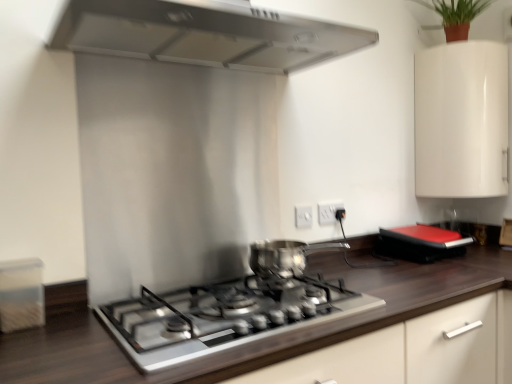
The height and width of the screenshot is (384, 512). Describe the element at coordinates (260, 340) in the screenshot. I see `dark wood countertop at center` at that location.

What do you see at coordinates (328, 212) in the screenshot?
I see `white plastic electric outlet at center, placed as the first electric outlet when sorted from back to front` at bounding box center [328, 212].

Describe the element at coordinates (204, 34) in the screenshot. The width and height of the screenshot is (512, 384). I see `stainless steel range hood at upper center` at that location.

In order to face satin silver gas stove at center, should I rotate leftwards or rightwards?

Rotate left and turn 2.851 degrees.

Where is `satin silver gas stove at center`? The width and height of the screenshot is (512, 384). satin silver gas stove at center is located at coordinates (224, 316).

Image resolution: width=512 pixels, height=384 pixels. What are the coordinates of `white plastic electric outlet at center, the 2th electric outlet viewed from the back` in the screenshot? It's located at (303, 216).

Does white glossy cabinet at upper right have a greater width compared to white plastic electric outlet at center, which ranks as the 1th electric outlet in front-to-back order?

Yes, white glossy cabinet at upper right is wider than white plastic electric outlet at center, which ranks as the 1th electric outlet in front-to-back order.

Is white glossy cabinet at upper right taller or shorter than white plastic electric outlet at center, the 2th electric outlet viewed from the back?

Considering their sizes, white glossy cabinet at upper right has more height than white plastic electric outlet at center, the 2th electric outlet viewed from the back.

Would you consider white glossy cabinet at upper right to be distant from white plastic electric outlet at center, the 1th electric outlet positioned from the left?

No, white glossy cabinet at upper right is not far away from white plastic electric outlet at center, the 1th electric outlet positioned from the left.

From the image's perspective, which electric outlet is the 2nd one below the white glossy cabinet at upper right? Please provide its 2D coordinates.

[(303, 216)]

In the scene shown: Which of these two, satin silver gas stove at center or white plastic electric outlet at center, the 1th electric outlet positioned from the left, is smaller?

white plastic electric outlet at center, the 1th electric outlet positioned from the left, is smaller.

From the image's perspective, is satin silver gas stove at center located above white plastic electric outlet at center, which ranks as the 1th electric outlet in front-to-back order?

Actually, satin silver gas stove at center appears below white plastic electric outlet at center, which ranks as the 1th electric outlet in front-to-back order, in the image.

Can white plastic electric outlet at center, marked as the 2th electric outlet in a right-to-left arrangement, be found inside satin silver gas stove at center?

No, white plastic electric outlet at center, marked as the 2th electric outlet in a right-to-left arrangement, is not a part of satin silver gas stove at center.

Which object is wider, white plastic electric outlet at center, acting as the 1th electric outlet starting from the right, or dark wood countertop at center?

Wider between the two is dark wood countertop at center.

Is white plastic electric outlet at center, acting as the 1th electric outlet starting from the right, in front of or behind dark wood countertop at center in the image?

white plastic electric outlet at center, acting as the 1th electric outlet starting from the right, is behind dark wood countertop at center.

Is white plastic electric outlet at center, acting as the 1th electric outlet starting from the right, with dark wood countertop at center?

white plastic electric outlet at center, acting as the 1th electric outlet starting from the right, and dark wood countertop at center are not in contact.

Image resolution: width=512 pixels, height=384 pixels. What are the coordinates of `the 2nd electric outlet above the dark wood countertop at center (from the image's perspective)` in the screenshot? It's located at (328, 212).

From a real-world perspective, is satin silver gas stove at center positioned over white glossy cabinet at upper right based on gravity?

Incorrect, from a real-world perspective, satin silver gas stove at center is lower than white glossy cabinet at upper right.

Which is in front, point (163, 365) or point (495, 158)?

The point (163, 365) is more forward.

Is satin silver gas stove at center shorter than white glossy cabinet at upper right?

Indeed, satin silver gas stove at center has a lesser height compared to white glossy cabinet at upper right.

In the image, is satin silver gas stove at center on the left side or the right side of white glossy cabinet at upper right?

satin silver gas stove at center is positioned on white glossy cabinet at upper right's left side.

Considering the positions of objects stainless steel range hood at upper center and green matte plant at upper right in the image provided, who is in front, stainless steel range hood at upper center or green matte plant at upper right?

stainless steel range hood at upper center is in front.

Which object is thinner, stainless steel range hood at upper center or green matte plant at upper right?

green matte plant at upper right is thinner.

The image size is (512, 384). What are the coordinates of `home appliance that is below the green matte plant at upper right (from the image's perspective)` in the screenshot? It's located at (204, 34).

Who is bigger, stainless steel range hood at upper center or green matte plant at upper right?

With larger size is stainless steel range hood at upper center.

Between shiny metallic pot at center and white plastic electric outlet at center, arranged as the second electric outlet when viewed from the front, which one has larger width?

Wider between the two is shiny metallic pot at center.

I want to click on the 2nd electric outlet behind when counting from the shiny metallic pot at center, so click(x=328, y=212).

Are shiny metallic pot at center and white plastic electric outlet at center, arranged as the second electric outlet when viewed from the front, far apart?

No.

Consider the image. Based on their sizes in the image, would you say shiny metallic pot at center is bigger or smaller than green matte plant at upper right?

shiny metallic pot at center is smaller than green matte plant at upper right.

Is shiny metallic pot at center aimed at green matte plant at upper right?

No, shiny metallic pot at center is not oriented towards green matte plant at upper right.

Who is taller, shiny metallic pot at center or green matte plant at upper right?

Standing taller between the two is green matte plant at upper right.

This screenshot has height=384, width=512. I want to click on plant above the shiny metallic pot at center (from a real-world perspective), so pos(455,11).

Where is `the 2nd electric outlet positioned below the white glossy cabinet at upper right (from the image's perspective)`? The height and width of the screenshot is (384, 512). the 2nd electric outlet positioned below the white glossy cabinet at upper right (from the image's perspective) is located at coordinates (303, 216).

Where is `gas stove that appears below the white plastic electric outlet at center, the 2th electric outlet viewed from the back (from a real-world perspective)`? This screenshot has height=384, width=512. gas stove that appears below the white plastic electric outlet at center, the 2th electric outlet viewed from the back (from a real-world perspective) is located at coordinates (224, 316).

Considering their positions, is stainless steel range hood at upper center positioned further to satin silver gas stove at center than white plastic electric outlet at center, placed as the first electric outlet when sorted from back to front?

stainless steel range hood at upper center is further to satin silver gas stove at center.

Based on their spatial positions, is satin silver gas stove at center or white plastic electric outlet at center, which ranks as the 1th electric outlet in front-to-back order, further from shiny metallic pot at center?

Based on the image, white plastic electric outlet at center, which ranks as the 1th electric outlet in front-to-back order, appears to be further to shiny metallic pot at center.

Based on their spatial positions, is white glossy cabinet at upper right or shiny metallic pot at center closer to green matte plant at upper right?

Based on the image, white glossy cabinet at upper right appears to be nearer to green matte plant at upper right.

Estimate the real-world distances between objects in this image. Which object is closer to white plastic electric outlet at center, which ranks as the 1th electric outlet in front-to-back order, stainless steel range hood at upper center or shiny metallic pot at center?

Based on the image, shiny metallic pot at center appears to be nearer to white plastic electric outlet at center, which ranks as the 1th electric outlet in front-to-back order.

Looking at the image, which one is located closer to stainless steel range hood at upper center, green matte plant at upper right or white glossy cabinet at upper right?

Among the two, white glossy cabinet at upper right is located nearer to stainless steel range hood at upper center.

From the image, which object appears to be nearer to white plastic electric outlet at center, which is counted as the 2th electric outlet, starting from the left, stainless steel range hood at upper center or green matte plant at upper right?

Based on the image, stainless steel range hood at upper center appears to be nearer to white plastic electric outlet at center, which is counted as the 2th electric outlet, starting from the left.

Consider the image. Estimate the real-world distances between objects in this image. Which object is closer to green matte plant at upper right, stainless steel range hood at upper center or dark wood countertop at center?

Based on the image, stainless steel range hood at upper center appears to be nearer to green matte plant at upper right.

Based on their spatial positions, is satin silver gas stove at center or stainless steel range hood at upper center closer to white plastic electric outlet at center, which is counted as the 2th electric outlet, starting from the left?

The object closer to white plastic electric outlet at center, which is counted as the 2th electric outlet, starting from the left, is satin silver gas stove at center.

At what (x,y) coordinates should I click in order to perform the action: click on gas stove between stainless steel range hood at upper center and dark wood countertop at center in the up-down direction. Please return your answer as a coordinate pair (x, y). The width and height of the screenshot is (512, 384). Looking at the image, I should click on (224, 316).

Locate an element on the screen. The width and height of the screenshot is (512, 384). kitchen appliance between stainless steel range hood at upper center and dark wood countertop at center in the up-down direction is located at coordinates (285, 256).

Locate an element on the screen. The image size is (512, 384). kitchen appliance between green matte plant at upper right and satin silver gas stove at center vertically is located at coordinates (285, 256).

The height and width of the screenshot is (384, 512). What are the coordinates of `cabinetry between green matte plant at upper right and dark wood countertop at center in the vertical direction` in the screenshot? It's located at (461, 120).